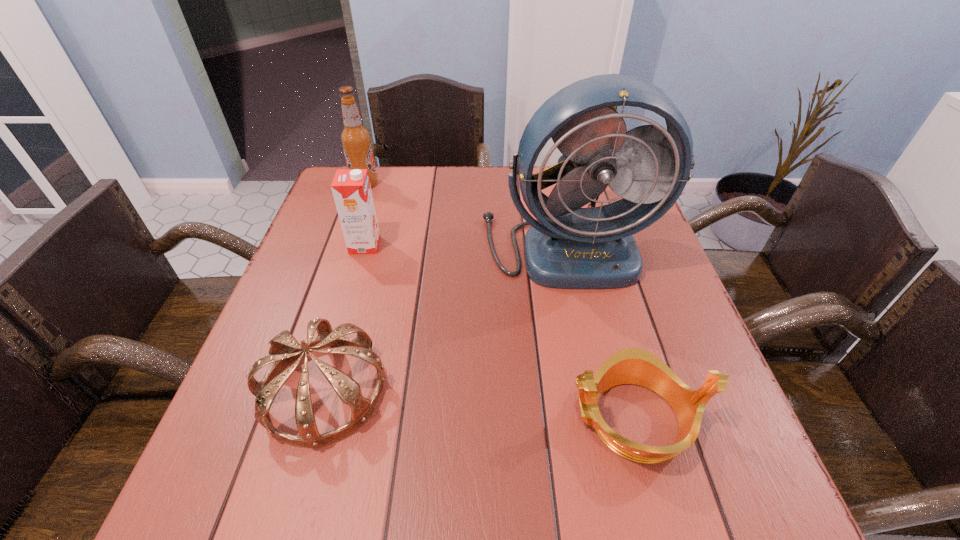
This screenshot has width=960, height=540. I want to click on free point between the right tiara and the tallest object, so click(x=600, y=333).

Locate an element on the screen. free spot between the left tiara and the tallest object is located at coordinates (445, 319).

Locate an element on the screen. The width and height of the screenshot is (960, 540). free spot between the fan and the right tiara is located at coordinates (600, 333).

The image size is (960, 540). Find the location of `free point between the tallest object and the left tiara`. free point between the tallest object and the left tiara is located at coordinates (445, 319).

Find the location of a particular element. Image resolution: width=960 pixels, height=540 pixels. vacant area that lies between the beer bottle and the right tiara is located at coordinates (499, 301).

The image size is (960, 540). I want to click on free space between the left tiara and the right tiara, so click(479, 404).

Find the location of a particular element. This screenshot has width=960, height=540. free space between the left tiara and the farthest object is located at coordinates (345, 287).

Locate an element on the screen. the fourth closest object to the carton is located at coordinates (636, 366).

The height and width of the screenshot is (540, 960). Identify the location of object identified as the third closest to the beer bottle. pyautogui.click(x=284, y=349).

Locate an element on the screen. free space that satisfies the following two spatial constraints: 1. on the front label of the carton; 2. on the left side of the farthest object is located at coordinates (344, 245).